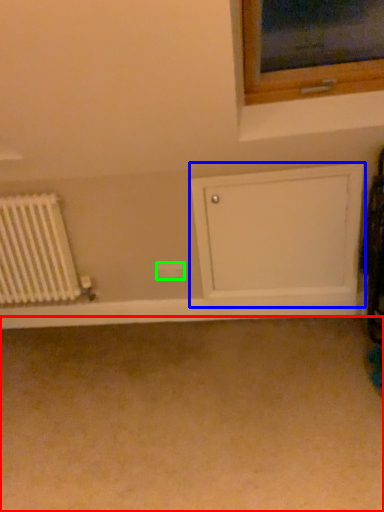
Question: Which object is the farthest from plain (highlighted by a red box)? Choose among these: shelf (highlighted by a blue box) or electric outlet (highlighted by a green box).

Choices:
 (A) shelf
 (B) electric outlet

Answer: (B)